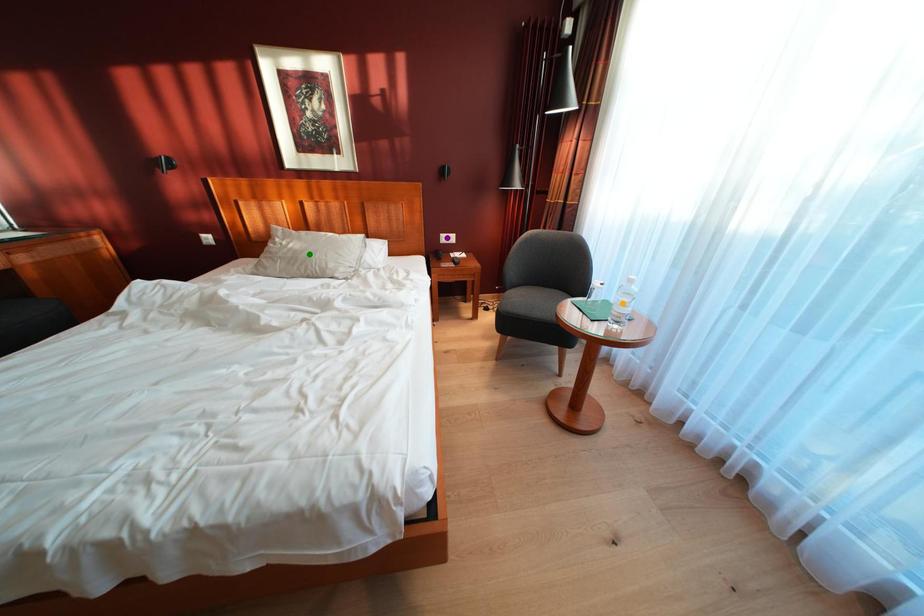
Consider the image. Order these from nearest to farthest:
A) purple point
B) green point
C) orange point

orange point < green point < purple point